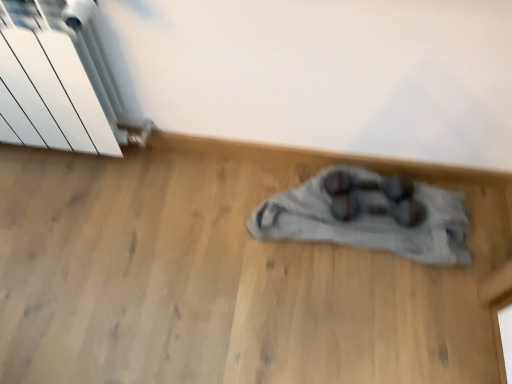
Find the location of `free space in front of shiny black dumbbells at center`. free space in front of shiny black dumbbells at center is located at coordinates (386, 240).